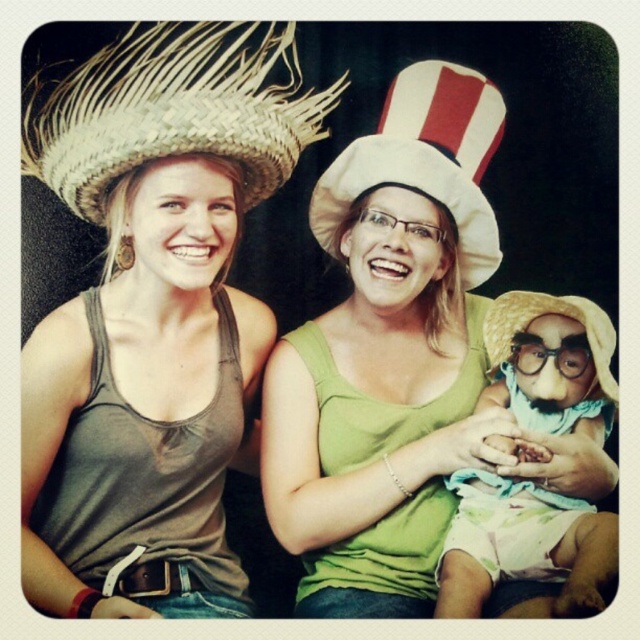
Is woven straw hat at upper left positioned before light yellow straw hat at lower right?

Yes, woven straw hat at upper left is closer to the viewer.

Which is below, woven straw hat at upper left or light yellow straw hat at lower right?

light yellow straw hat at lower right is lower down.

Is point (166, 28) more distant than point (589, 508)?

No, it is in front of (589, 508).

Locate an element on the screen. This screenshot has height=640, width=640. woven straw hat at upper left is located at coordinates (173, 109).

Does point (205, 353) lie behind point (54, 97)?

Yes, point (205, 353) is behind point (54, 97).

Does matte straw hat at left have a larger size compared to woven straw hat at upper left?

Yes, matte straw hat at left is bigger than woven straw hat at upper left.

Does point (244, 387) come behind point (228, 24)?

Yes, point (244, 387) is behind point (228, 24).

Locate an element on the screen. The width and height of the screenshot is (640, 640). matte straw hat at left is located at coordinates (154, 252).

Does light yellow straw hat at lower right have a lesser width compared to strawtexturehat at lower right?

In fact, light yellow straw hat at lower right might be wider than strawtexturehat at lower right.

Can you confirm if light yellow straw hat at lower right is shorter than strawtexturehat at lower right?

Incorrect, light yellow straw hat at lower right's height does not fall short of strawtexturehat at lower right's.

Locate an element on the screen. light yellow straw hat at lower right is located at coordinates (520, 545).